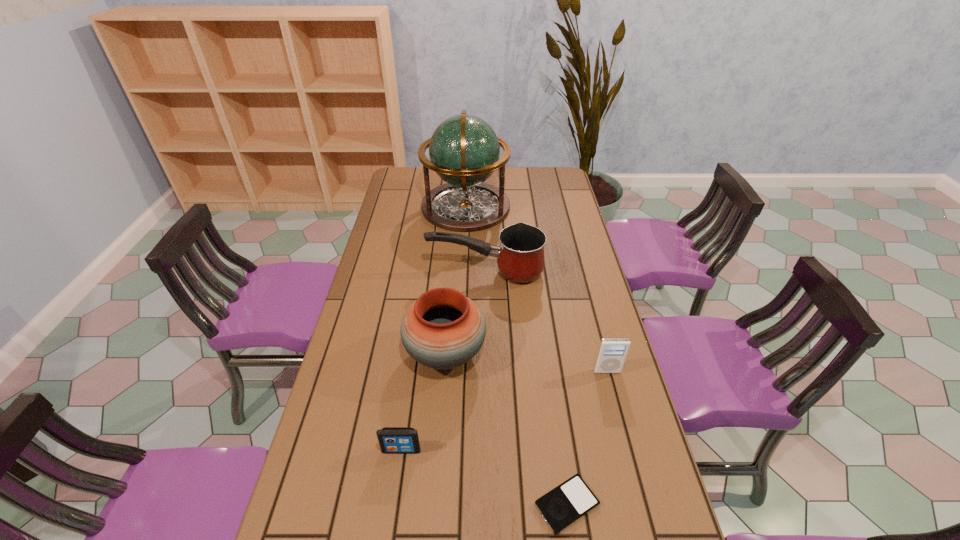
This screenshot has width=960, height=540. I want to click on the tallest object, so [x=464, y=151].

In order to click on globe in this screenshot , I will do `click(464, 151)`.

Where is `pottery`? The width and height of the screenshot is (960, 540). pottery is located at coordinates coord(443,329).

At what (x,y) coordinates should I click in order to perform the action: click on the fifth nearest object. Please return your answer as a coordinate pair (x, y). Looking at the image, I should click on (520, 257).

What are the coordinates of `the third tallest object` in the screenshot? It's located at (520, 257).

This screenshot has width=960, height=540. I want to click on the tallest iPod, so click(612, 353).

Locate an element on the screen. The height and width of the screenshot is (540, 960). the fourth tallest object is located at coordinates (612, 353).

Where is `the second nearest object`? the second nearest object is located at coordinates (393, 440).

The width and height of the screenshot is (960, 540). Identify the location of the leftmost iPod. (393, 440).

The image size is (960, 540). I want to click on the nearest iPod, so click(568, 502).